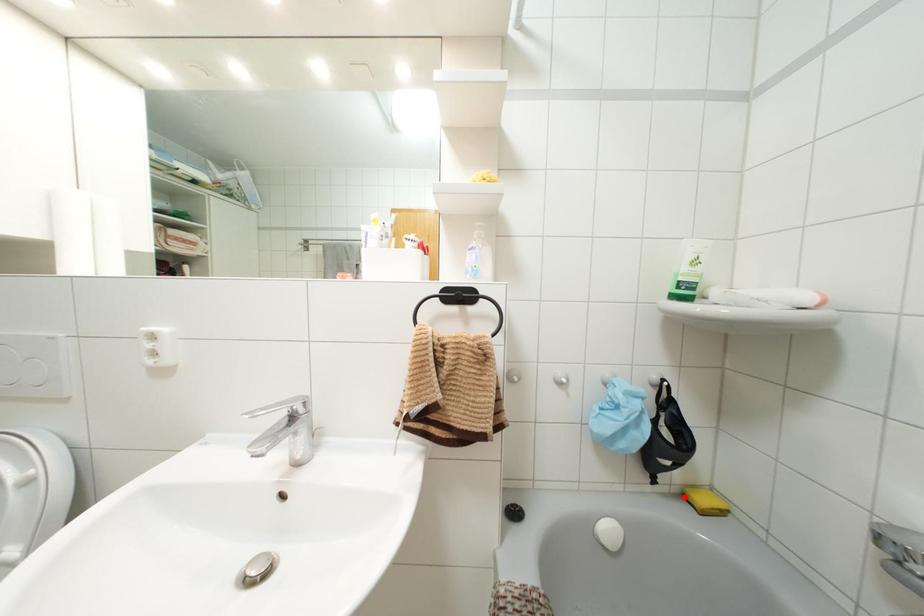
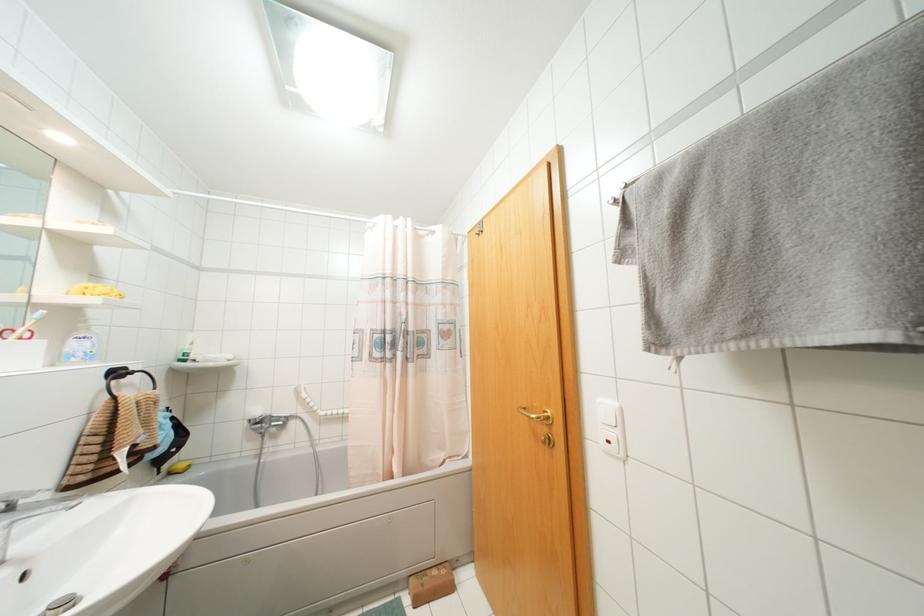
The point at the highlighted location is marked in the first image. Where is the corresponding point in the second image?

(169, 472)